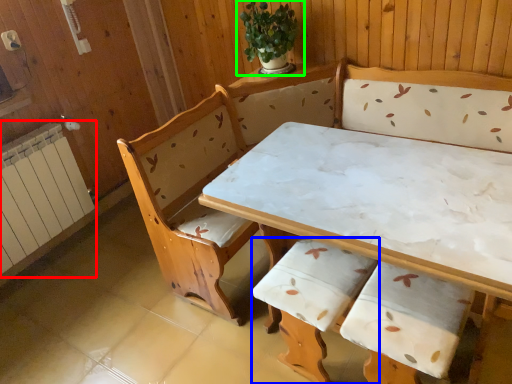
Question: Considering the real-world distances, which object is closest to radiator (highlighted by a red box)? armchair (highlighted by a blue box) or houseplant (highlighted by a green box).

Choices:
 (A) armchair
 (B) houseplant

Answer: (B)